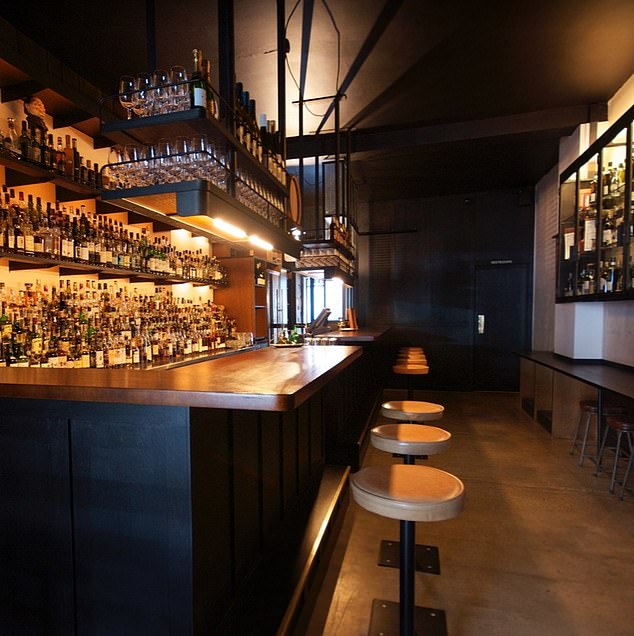
This screenshot has width=634, height=636. I want to click on rows of liquor, so click(x=122, y=333), click(x=99, y=240), click(x=47, y=151).